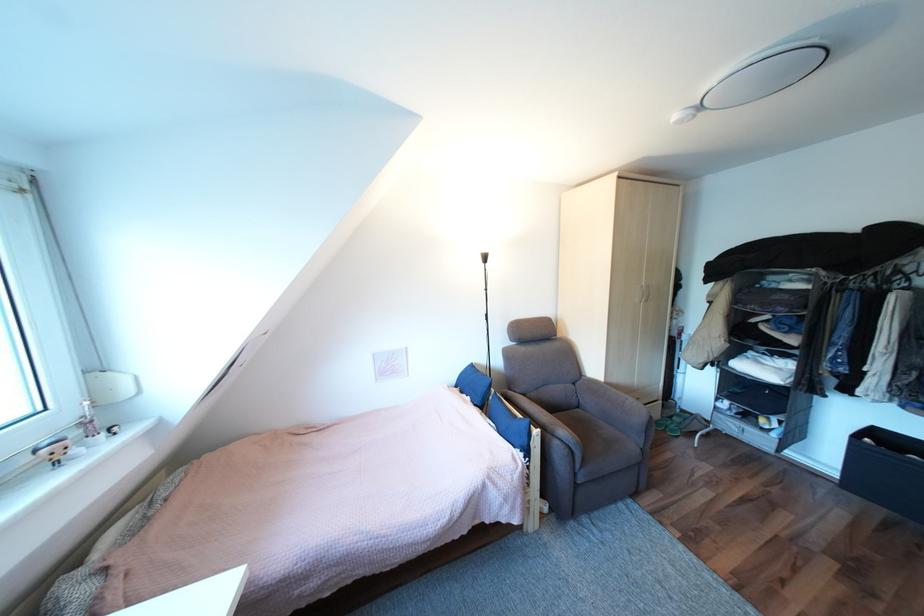
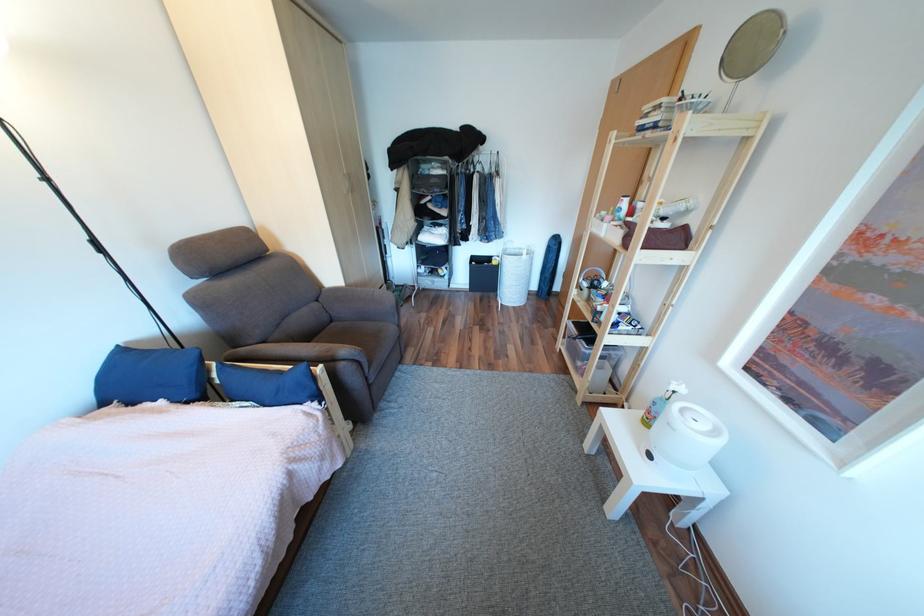
Where in the second image is the point corresponding to (590,410) from the first image?

(344, 323)